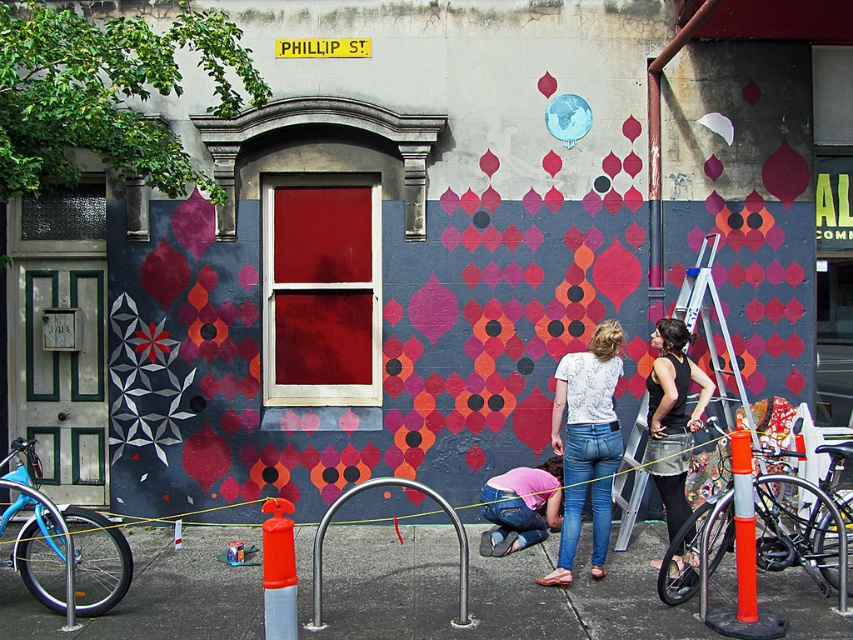
Question: Estimate the real-world distances between objects in this image. Which object is closer to the orange rubber bicycle at lower right?

Choices:
 (A) metallic silver ladder at center right
 (B) blue matte bicycle at left
 (C) black mesh tank top at center

Answer: (C)

Question: Which point appears farthest from the camera in this image?

Choices:
 (A) (762, 476)
 (B) (519, 531)

Answer: (B)

Question: Is metallic silver ladder at center right to the left of pink fabric at center from the viewer's perspective?

Choices:
 (A) yes
 (B) no

Answer: (B)

Question: Is black mesh tank top at center further to camera compared to pink fabric at center?

Choices:
 (A) yes
 (B) no

Answer: (B)

Question: Does orange rubber bicycle at lower right have a larger size compared to white printed shirt at center?

Choices:
 (A) no
 (B) yes

Answer: (B)

Question: Which object is closer to the camera taking this photo?

Choices:
 (A) metallic silver ladder at center right
 (B) orange rubber bicycle at lower right
 (C) black mesh tank top at center

Answer: (B)